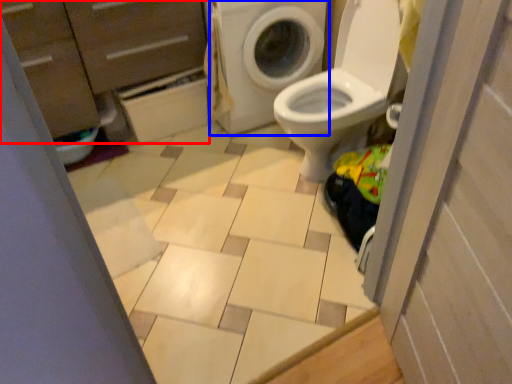
Question: Among these objects, which one is farthest to the camera, dresser (highlighted by a red box) or washing machine (highlighted by a blue box)?

Choices:
 (A) dresser
 (B) washing machine

Answer: (B)